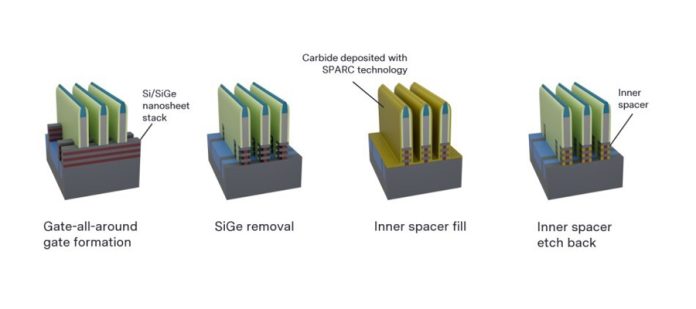
Where is `mustard colored folders`? mustard colored folders is located at coordinates (388, 117), (408, 95), (432, 95).